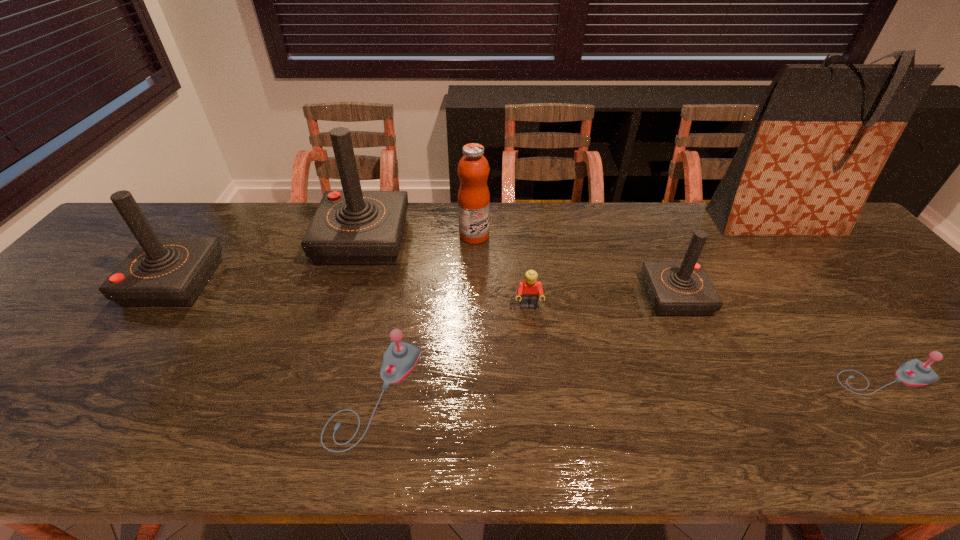
The height and width of the screenshot is (540, 960). I want to click on vacant space located 0.110m on the rectangular base of the third object from right to left, so click(x=604, y=296).

Locate an element on the screen. The width and height of the screenshot is (960, 540). free region located on the face of the fifth object from left to right is located at coordinates (544, 451).

Find the location of a particular element. This screenshot has height=540, width=960. vacant space located on the left of the second shortest joystick is located at coordinates (281, 394).

Identify the location of vacant space situated 0.070m on the left of the rightmost joystick. Image resolution: width=960 pixels, height=540 pixels. (804, 379).

Identify the location of shopping bag that is at the far edge. This screenshot has height=540, width=960. (822, 133).

Locate an element on the screen. This screenshot has width=960, height=540. joystick present at the far edge is located at coordinates (351, 227).

The height and width of the screenshot is (540, 960). Identify the location of fruit juice situated at the far edge. (473, 169).

Where is `object located at the near edge`? object located at the near edge is located at coordinates (400, 358).

This screenshot has width=960, height=540. What are the coordinates of `shopping bag situated at the right edge` in the screenshot? It's located at (822, 133).

The height and width of the screenshot is (540, 960). I want to click on joystick present at the right edge, so click(x=914, y=372).